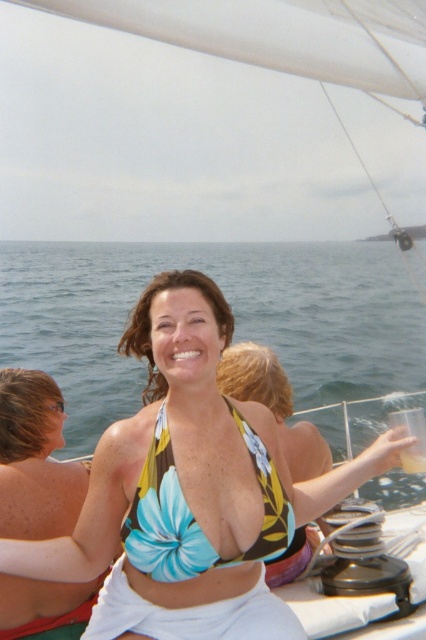
Can you confirm if translucent plastic cup at upper right is positioned to the right of clear plastic cup at upper right?

No, translucent plastic cup at upper right is not to the right of clear plastic cup at upper right.

Can you confirm if translucent plastic cup at upper right is bigger than clear plastic cup at upper right?

Yes.

Describe the element at coordinates (414, 436) in the screenshot. This screenshot has height=640, width=426. I see `translucent plastic cup at upper right` at that location.

The height and width of the screenshot is (640, 426). In order to click on translucent plastic cup at upper right in this screenshot , I will do `click(414, 436)`.

How distant is clear blue water at center from matte skin at upper left?

clear blue water at center is 23.09 meters away from matte skin at upper left.

Where is `clear blue water at center`? This screenshot has height=640, width=426. clear blue water at center is located at coordinates (233, 308).

What do you see at coordinates (233, 308) in the screenshot?
I see `clear blue water at center` at bounding box center [233, 308].

This screenshot has height=640, width=426. In order to click on clear blue water at center in this screenshot , I will do `click(233, 308)`.

Is point (146, 544) farther from viewer compared to point (408, 456)?

No, (146, 544) is in front of (408, 456).

Is point (152, 577) more distant than point (420, 451)?

No, it is in front of (420, 451).

In order to click on blue floral bikini top at center in this screenshot , I will do `click(193, 516)`.